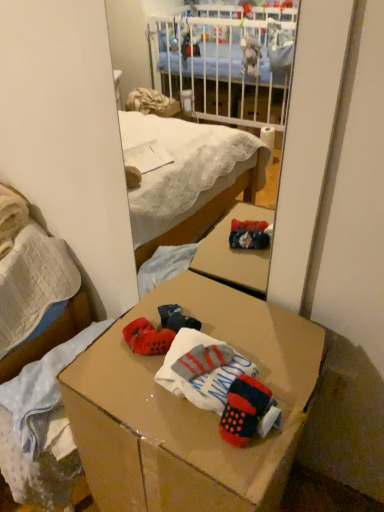
This screenshot has height=512, width=384. Identify the location of free spot behind knitted wool socks at center. (258, 338).